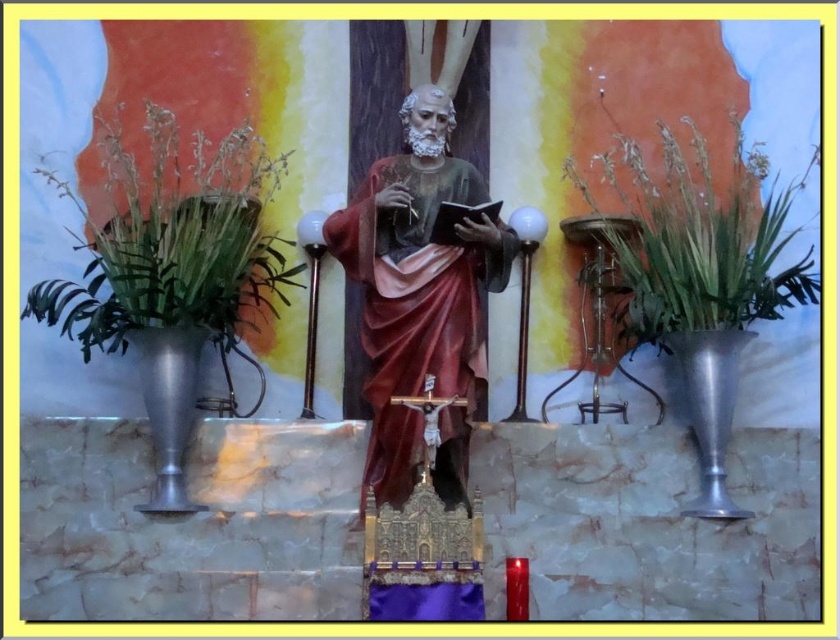
You are an interior designer planning to place a new sculpture in the same space as the matte wood statue at center and the metallic vase at right. If the sculpture must be larger than both existing objects, which object should you consider the size of the sculpture relative to?

The sculpture must be larger than both the matte wood statue at center and the metallic vase at right. Since the metallic vase at right is larger than the matte wood statue at center, the sculpture needs to be larger than the metallic vase at right to satisfy both requirements.

As a photographer standing at the camera position, you want to capture a closeup shot of the matte wood statue at center. Given that your camera can focus on subjects within 50 meters, will you be able to take the closeup without moving closer?

The distance between the matte wood statue at center and the camera is 52.13 meters, which is beyond the camera focus range of 50 meters. Therefore, you cannot take the closeup without moving closer.